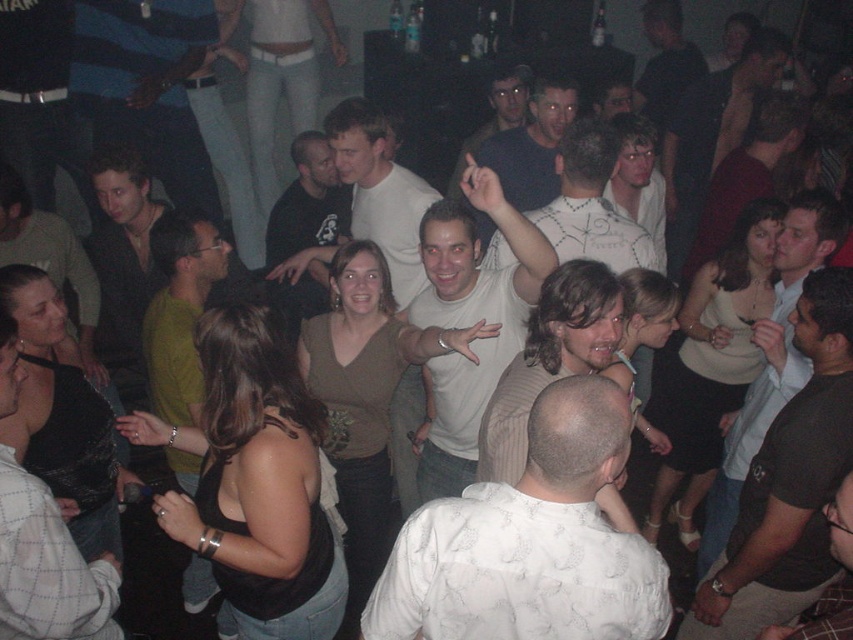
Between point (345, 586) and point (770, 451), which one is positioned behind?

The point (770, 451) is behind.

Which is more to the left, black fabric top at center or dark brown t-shirt at center?

black fabric top at center is more to the left.

Is point (178, 429) in front of point (831, 330)?

No.

Locate an element on the screen. black fabric top at center is located at coordinates coord(254,483).

Can you confirm if matte black tank top at lower left is positioned below matte white shirt at center?

Yes.

Which is in front, point (1, 445) or point (552, 104)?

Point (1, 445) is more forward.

At what (x,y) coordinates should I click in order to perform the action: click on matte black tank top at lower left. Please return your answer as a coordinate pair (x, y). Looking at the image, I should click on (47, 566).

Is the position of black fabric top at center more distant than that of green sweater at left?

No, it is not.

Between black fabric top at center and green sweater at left, which one appears on the right side from the viewer's perspective?

black fabric top at center is more to the right.

Locate an element on the screen. black fabric top at center is located at coordinates (254, 483).

At what (x,y) coordinates should I click in order to perform the action: click on black fabric top at center. Please return your answer as a coordinate pair (x, y). Image resolution: width=853 pixels, height=640 pixels. Looking at the image, I should click on (254, 483).